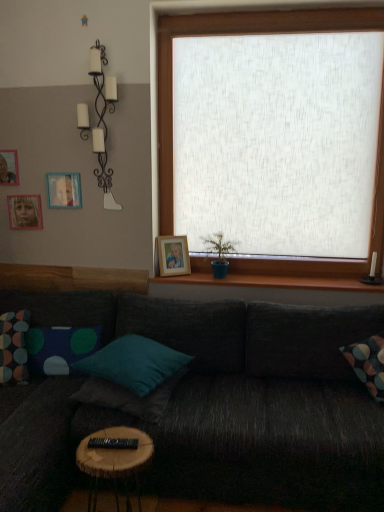
Question: Considering the positions of point (38, 312) and point (102, 50), is point (38, 312) closer or farther from the camera than point (102, 50)?

Choices:
 (A) farther
 (B) closer

Answer: (A)

Question: Visually, is dark gray fabric couch at center positioned to the left or to the right of white matte candle holder at upper left?

Choices:
 (A) right
 (B) left

Answer: (A)

Question: Which object is positioned closest to the wooden round table at lower center?

Choices:
 (A) wooden picture frame at upper left, which is the 1th picture frame in top-to-bottom order
 (B) polka dot fabric pillow at left, which ranks as the third pillow in right-to-left order
 (C) multicolored fabric pillow at left, the 1th pillow viewed from the left
 (D) wooden picture frame at center, which is the 1th picture frame in right-to-left order
 (E) matte wooden picture frame at upper left, the 2th picture frame viewed from the left

Answer: (B)

Question: Estimate the real-world distances between objects in this image. Which object is closer to the wooden round table at lower center?

Choices:
 (A) polka dot fabric pillow at left, the 2th pillow positioned from the left
 (B) teal fabric pillow at center, marked as the first pillow in a right-to-left arrangement
 (C) matte wooden picture frame at upper left, the 2th picture frame viewed from the left
 (D) wooden picture frame at center, which is the 1th picture frame in right-to-left order
 (E) multicolored fabric pillow at left, the 1th pillow viewed from the left

Answer: (B)